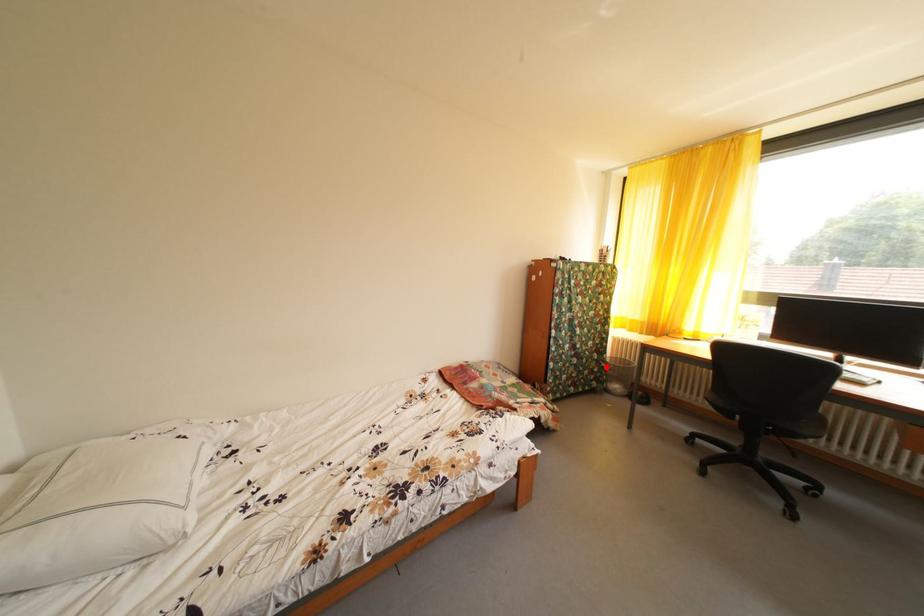
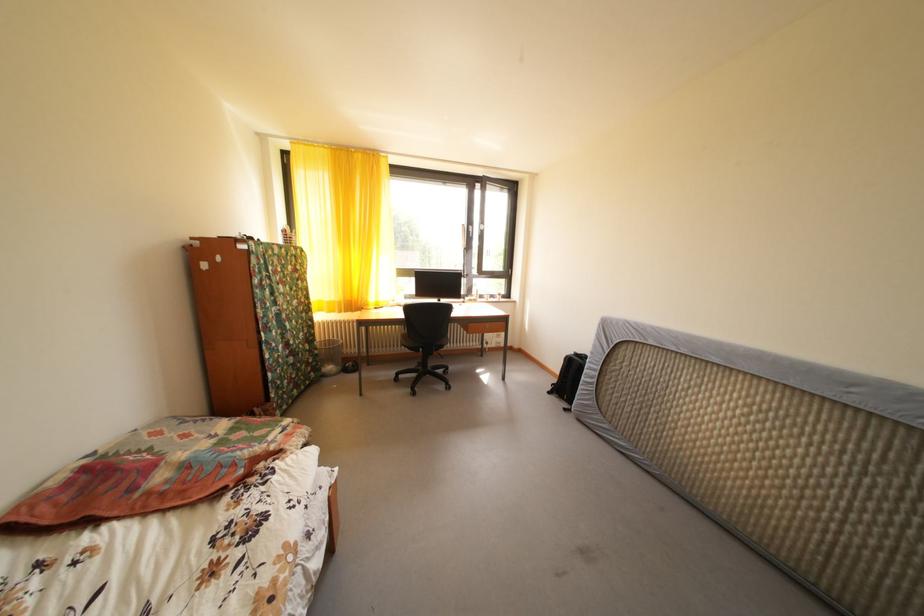
Find the pixel in the second image that matches the highlighted location in the first image.

(320, 357)